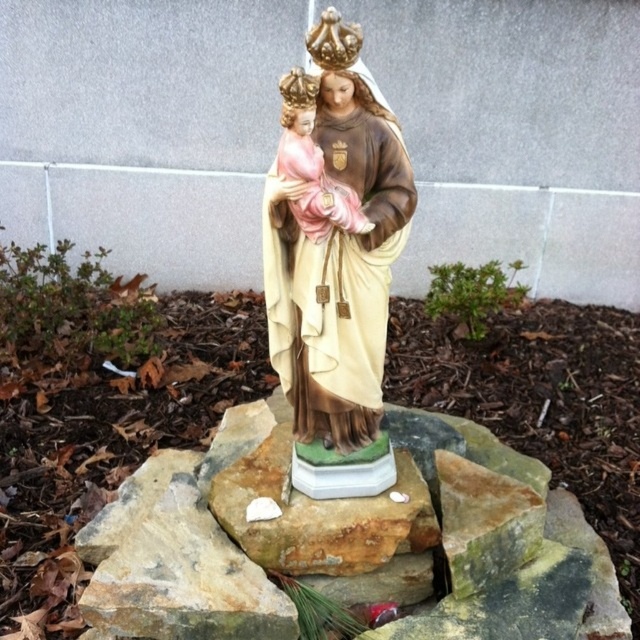
You are an artist planning to place a new sculpture between the green stone at center and the matte porcelain doll at center. To ensure stability, you need to know which object has a wider base. Which one is wider?

The green stone at center has a larger width than the matte porcelain doll at center, so it has a wider base.

You are a visitor at the garden and want to take a photo of the matte porcelain statue at center and the matte porcelain doll at center. Which one should you focus on first if you want to capture both in the same frame without moving the camera?

The matte porcelain statue at center is positioned under the matte porcelain doll at center, so you should focus on the statue first as it is lower in the frame to ensure both are in the same shot.